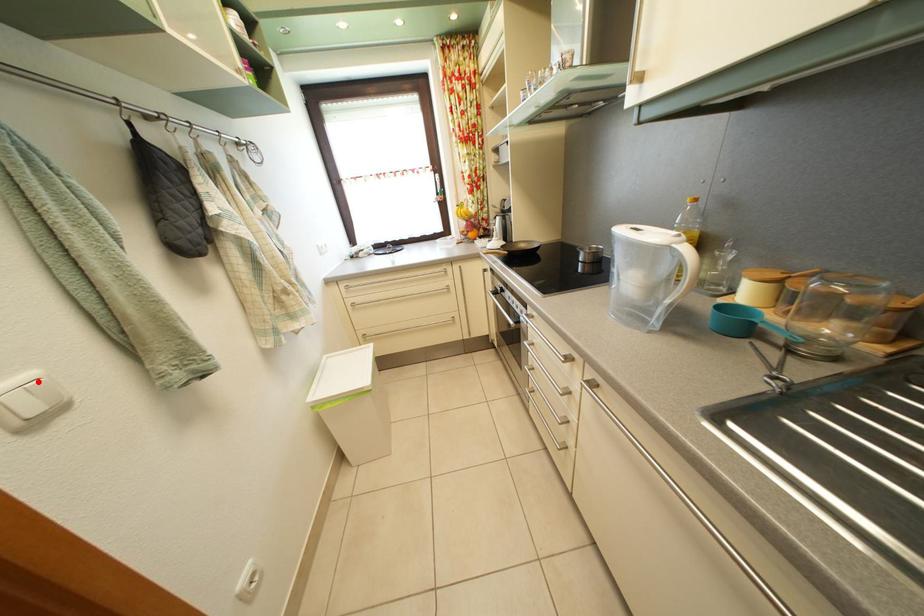
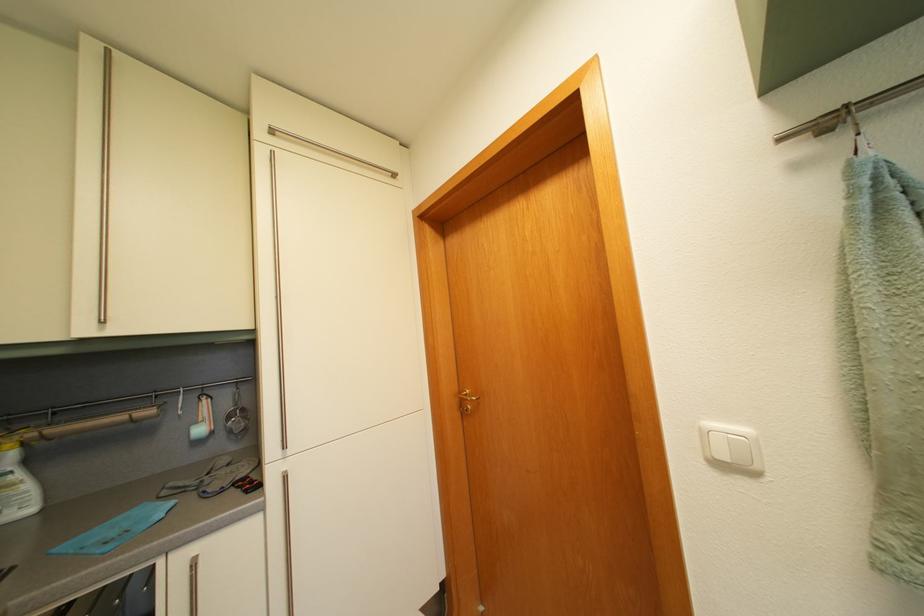
Locate, in the second image, the point that corresponds to the highlighted location in the first image.

(755, 438)